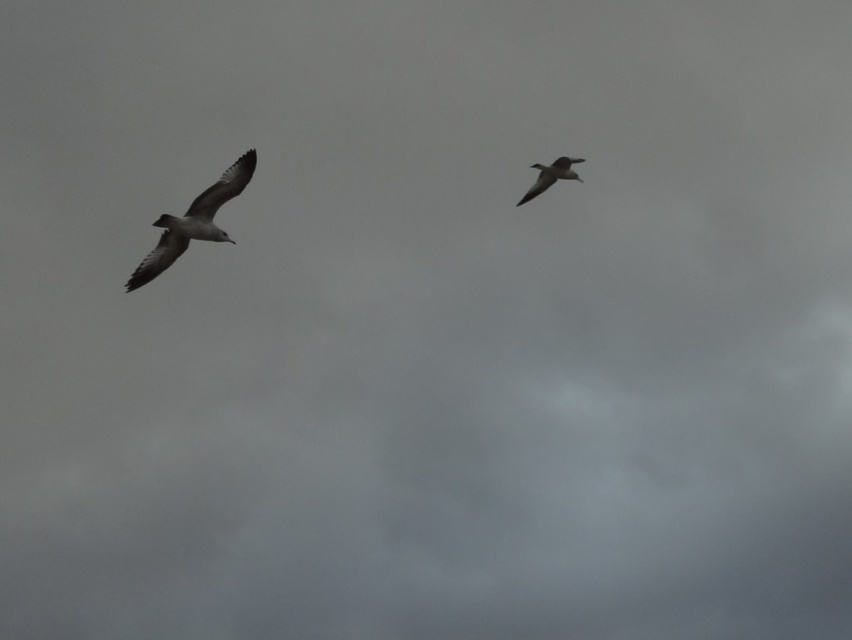
Measure the distance between white feathered bird at left and gray feathered bird at upper right.

white feathered bird at left is 6.89 meters from gray feathered bird at upper right.

Is white feathered bird at left to the right of gray feathered bird at upper right from the viewer's perspective?

In fact, white feathered bird at left is to the left of gray feathered bird at upper right.

Find the location of `white feathered bird at left`. white feathered bird at left is located at coordinates (193, 221).